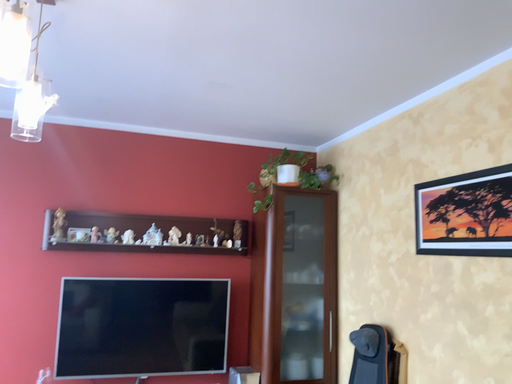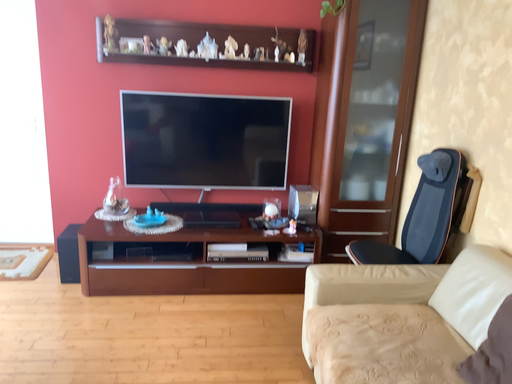
Question: Which way did the camera rotate in the video?

Choices:
 (A) rotated left
 (B) rotated right

Answer: (A)